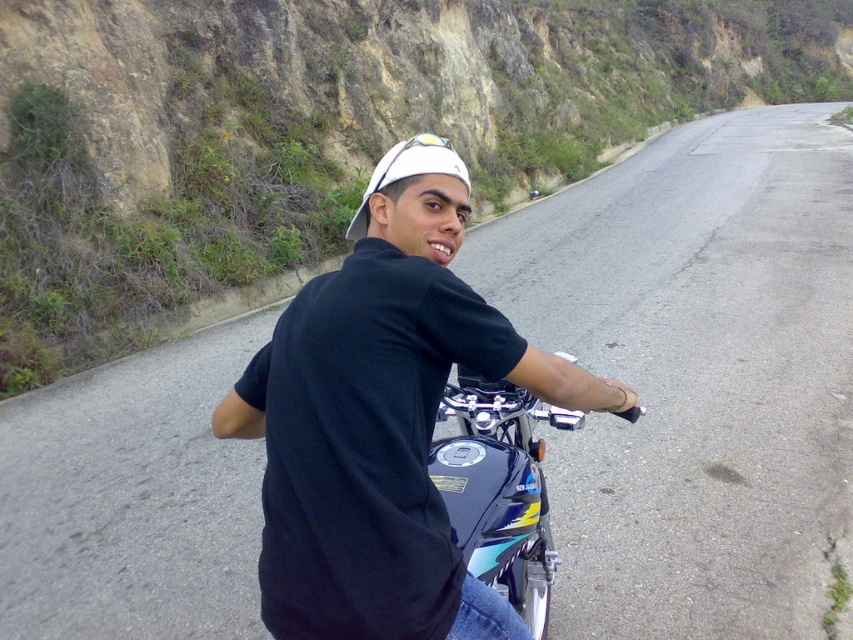
You are a photographer trying to capture the rider and the motorcycle. If you want to focus on the black matte shirt at center first, then shift your focus to the glossy metallic motorcycle at center, in which direction should you move your camera?

You should move your camera to the right because the black matte shirt at center is to the left of the glossy metallic motorcycle at center.